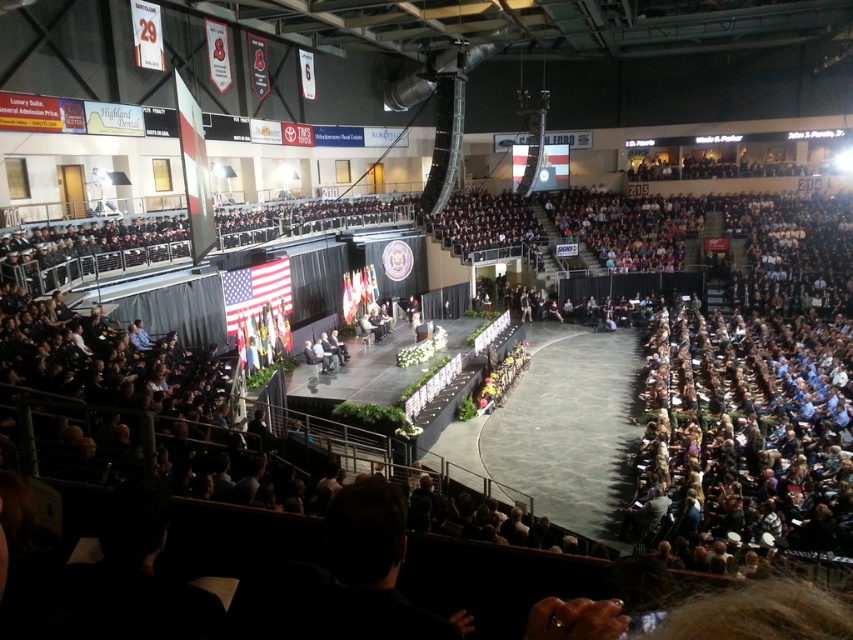
Based on the photo, between matte american flag at center and silk american flag at center stage, which one is positioned higher?

silk american flag at center stage

Who is positioned more to the right, matte american flag at center or silk american flag at center stage?

silk american flag at center stage is more to the right.

The image size is (853, 640). Find the location of `matte american flag at center`. matte american flag at center is located at coordinates (258, 310).